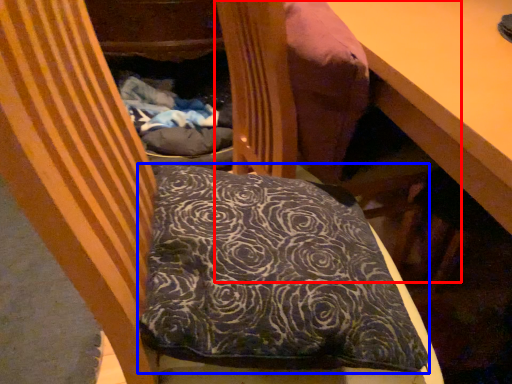
Question: Which object is further to the camera taking this photo, bean bag chair (highlighted by a red box) or pillow (highlighted by a blue box)?

Choices:
 (A) bean bag chair
 (B) pillow

Answer: (A)